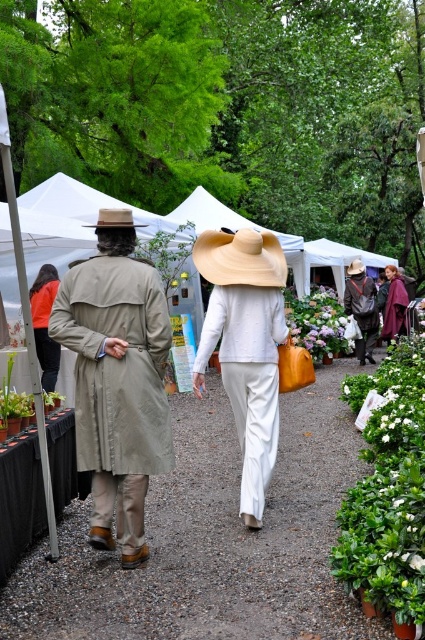
You are a photographer trying to capture both the matte brown hat at center and the brown leather hat at center in a single shot. Which hat appears shorter in the photo?

The matte brown hat at center appears shorter in the photo because it has a lesser height compared to the brown leather hat at center.

You are a photographer standing at the center of the market. You want to take a photo that includes both the matte brown hat at center and the brown leather hat at center. Given that your camera has a maximum focus range of 7 meters, will you be able to capture both hats in the same frame without moving?

The distance between the matte brown hat at center and the brown leather hat at center is 8.00 meters. Since your camera can only focus up to 7 meters, you won t be able to capture both hats in the same frame without moving closer or adjusting your position.

You are a photographer trying to capture both the khaki fabric trench coat at left and the brown felt cowboy hat at upper center in a single frame. Given their sizes, which object should you focus on to ensure both fit in the photo without cropping?

The khaki fabric trench coat at left is wider than the brown felt cowboy hat at upper center, so you should focus on the khaki fabric trench coat at left to ensure both fit in the photo without cropping.